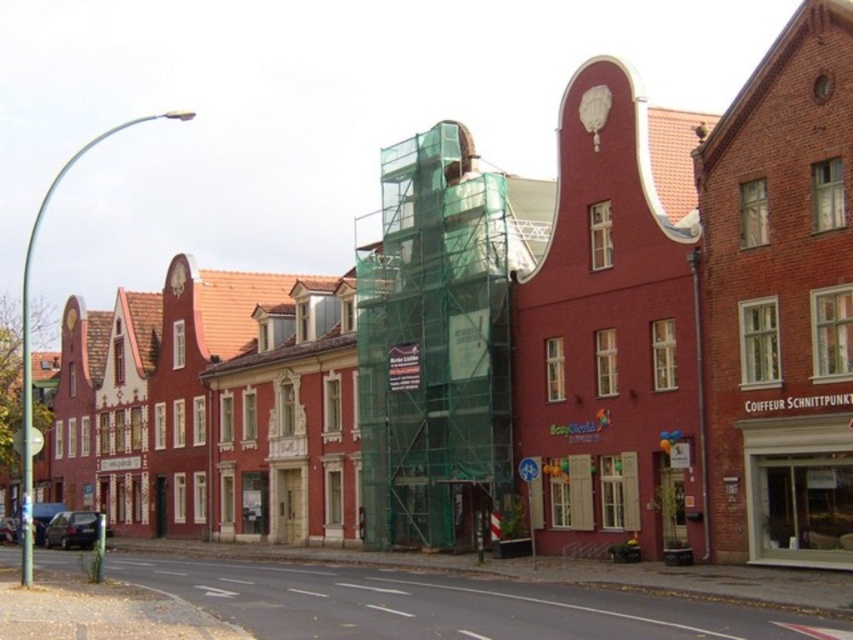
You are standing on the street in front of the row of traditional European buildings. There is a point marked at coordinates [614,326]. What is located at this point?

The point at coordinates [614,326] is occupied by the matte red building at center.

You are a painter who needs to estimate the materials required for a project. You observe the matte red building at center and the green mesh scaffolding at center in the scene. Which object is wider?

The matte red building at center is wider than the green mesh scaffolding at center, so the building requires more materials for its width.